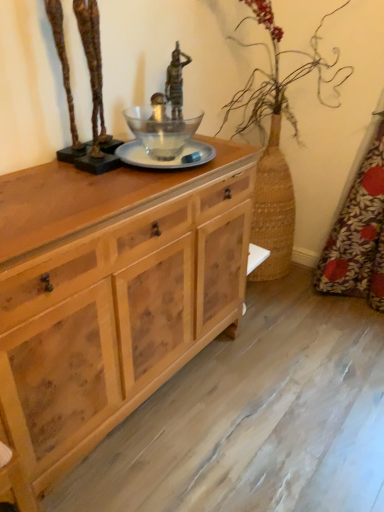
Where is `bronze statue at center`? bronze statue at center is located at coordinates (176, 82).

Describe the element at coordinates (111, 294) in the screenshot. I see `natural wood cabinet at center` at that location.

The height and width of the screenshot is (512, 384). Identify the location of natural wood cabinet at center. (111, 294).

Find the location of a particular element. This screenshot has width=384, height=512. floral fabric at right is located at coordinates (x=358, y=234).

This screenshot has height=512, width=384. Describe the element at coordinates (91, 87) in the screenshot. I see `bronze sculpture at upper left` at that location.

Locate an element on the screen. bronze statue at center is located at coordinates (176, 82).

Could you tell me if bronze statue at center is facing floral fabric at right?

No, bronze statue at center is not turned towards floral fabric at right.

Find the location of a particular element. The height and width of the screenshot is (512, 384). sculpture on the left side of floral fabric at right is located at coordinates (176, 82).

Is point (181, 95) closer or farther from the camera than point (77, 12)?

Point (181, 95).

Is bronze statue at center located outside bronze sculpture at upper left?

bronze statue at center lies outside bronze sculpture at upper left's area.

Which is behind, bronze statue at center or bronze sculpture at upper left?

Positioned behind is bronze statue at center.

Could you tell me if bronze statue at center is facing bronze sculpture at upper left?

No.

Is point (64, 67) positioned before point (346, 270)?

Yes, point (64, 67) is in front of point (346, 270).

I want to click on bronze statue located on the left of floral fabric at right, so (x=91, y=87).

Can you confirm if bronze sculpture at upper left is positioned to the left of floral fabric at right?

Correct, you'll find bronze sculpture at upper left to the left of floral fabric at right.

Can you confirm if bronze sculpture at upper left is taller than floral fabric at right?

Incorrect, the height of bronze sculpture at upper left is not larger of that of floral fabric at right.

Can you confirm if natural wood cabinet at center is shorter than floral fabric at right?

Correct, natural wood cabinet at center is not as tall as floral fabric at right.

Measure the distance from natural wood cabinet at center to floral fabric at right.

They are 1.03 meters apart.

From a real-world perspective, is natural wood cabinet at center located beneath floral fabric at right?

Indeed, from a real-world perspective, natural wood cabinet at center is positioned beneath floral fabric at right.

Is floral fabric at right at the back of natural wood cabinet at center?

No, floral fabric at right is not at the back of natural wood cabinet at center.

You are a GUI agent. You are given a task and a screenshot of the screen. Output one action in this format:
    pyautogui.click(x=<x>, y=<y>)
    Task: Click on the curtain that appears behind the natural wood cabinet at center
    
    Given the screenshot: What is the action you would take?
    pyautogui.click(x=358, y=234)

Looking at their sizes, would you say floral fabric at right is wider or thinner than natural wood cabinet at center?

Clearly, floral fabric at right has less width compared to natural wood cabinet at center.

Which point is more distant from viewer, (334, 248) or (135, 390)?

Point (334, 248)

Is floral fabric at right aimed at natural wood cabinet at center?

No, floral fabric at right is not facing towards natural wood cabinet at center.

Which is farther, (96, 379) or (172, 117)?

Point (172, 117)

From a real-world perspective, is natural wood cabinet at center physically located above or below bronze statue at center?

natural wood cabinet at center is situated lower than bronze statue at center in the real world.

How different are the orientations of natural wood cabinet at center and bronze statue at center in degrees?

There is a 6.9-degree angle between the facing directions of natural wood cabinet at center and bronze statue at center.

From a real-world perspective, which object rests below the other?

bronze statue at center is physically lower.

What's the angular difference between bronze sculpture at upper left and bronze statue at center's facing directions?

The facing directions of bronze sculpture at upper left and bronze statue at center are 8.13 degrees apart.

From the image's perspective, would you say bronze sculpture at upper left is shown under bronze statue at center?

Yes, from the image's perspective, bronze sculpture at upper left is beneath bronze statue at center.

Identify the location of curtain beneath the bronze statue at center (from a real-world perspective). This screenshot has width=384, height=512. (358, 234).

Where is `bronze statue in front of the bronze statue at center`? The width and height of the screenshot is (384, 512). bronze statue in front of the bronze statue at center is located at coordinates (91, 87).

Considering their positions, is bronze statue at center positioned further to floral fabric at right than natural wood cabinet at center?

Among the two, natural wood cabinet at center is located further to floral fabric at right.

Looking at the image, which one is located closer to floral fabric at right, bronze sculpture at upper left or natural wood cabinet at center?

natural wood cabinet at center is positioned closer to the anchor floral fabric at right.

Looking at the image, which one is located further to natural wood cabinet at center, bronze statue at center or bronze sculpture at upper left?

Among the two, bronze statue at center is located further to natural wood cabinet at center.

Based on their spatial positions, is bronze statue at center or floral fabric at right further from natural wood cabinet at center?

floral fabric at right.

Based on the photo, estimate the real-world distances between objects in this image. Which object is further from bronze statue at center, bronze sculpture at upper left or floral fabric at right?

floral fabric at right lies further to bronze statue at center than the other object.

Looking at the image, which one is located further to bronze sculpture at upper left, floral fabric at right or natural wood cabinet at center?

floral fabric at right.

Which object lies nearer to the anchor point bronze statue at center, natural wood cabinet at center or bronze sculpture at upper left?

Among the two, bronze sculpture at upper left is located nearer to bronze statue at center.

From the image, which object appears to be nearer to bronze statue at center, bronze sculpture at upper left or natural wood cabinet at center?

bronze sculpture at upper left lies closer to bronze statue at center than the other object.

The width and height of the screenshot is (384, 512). In order to click on the chest of drawers located between bronze sculpture at upper left and floral fabric at right in the left-right direction in this screenshot , I will do `click(111, 294)`.

At what (x,y) coordinates should I click in order to perform the action: click on sculpture located between natural wood cabinet at center and floral fabric at right in the left-right direction. Please return your answer as a coordinate pair (x, y). The height and width of the screenshot is (512, 384). Looking at the image, I should click on (176, 82).

This screenshot has width=384, height=512. I want to click on bronze statue between bronze statue at center and natural wood cabinet at center vertically, so click(x=91, y=87).

This screenshot has width=384, height=512. Find the location of `sculpture situated between bronze sculpture at upper left and floral fabric at right from left to right`. sculpture situated between bronze sculpture at upper left and floral fabric at right from left to right is located at coordinates (176, 82).